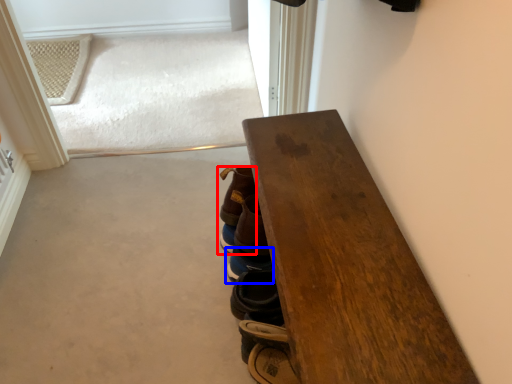
Question: Among these objects, which one is nearest to the camera, footwear (highlighted by a red box) or footwear (highlighted by a blue box)?

Choices:
 (A) footwear
 (B) footwear

Answer: (A)